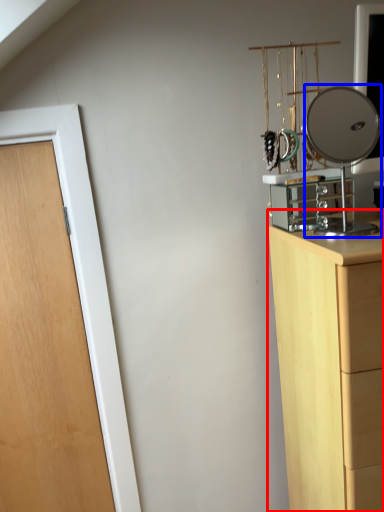
Question: Which point is further to the camera, chest of drawers (highlighted by a red box) or mirror (highlighted by a blue box)?

Choices:
 (A) chest of drawers
 (B) mirror

Answer: (B)